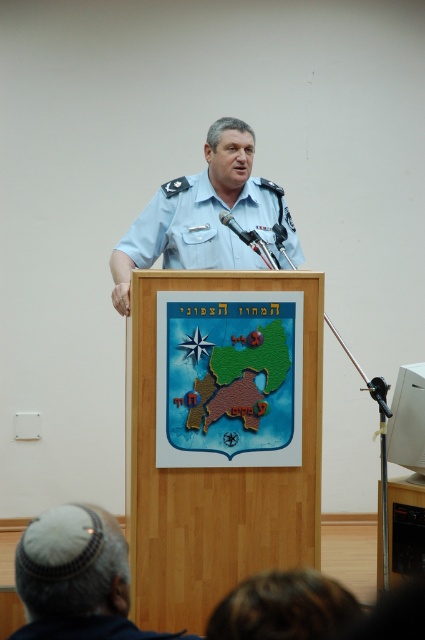
You are organizing a uniform fitting event and need to ensure that the blue uniform at center and the blue fabric uniform at center are displayed correctly. Which uniform should be placed on the larger mannequin?

The blue uniform at center should be placed on the larger mannequin because it has a larger size compared to the blue fabric uniform at center.

You are organizing a community event and need to place a name tag on the white wool kippah at lower left and the blue fabric uniform at center. Which item can accommodate a larger name tag without looking overcrowded?

The white wool kippah at lower left has a larger size compared to the blue fabric uniform at center, so it can accommodate a larger name tag without looking overcrowded.